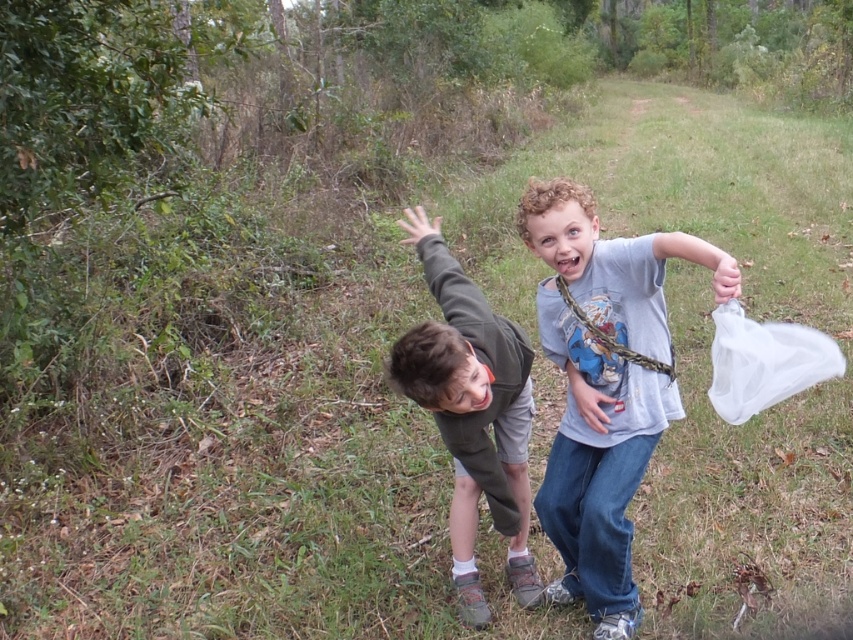
You are a photographer trying to capture both the dark gray fabric shirt at center and the transparent plastic bag at right in a single frame. Which object should you focus on first to ensure both are in the frame without moving the camera?

You should focus on the dark gray fabric shirt at center first because it is wider than the transparent plastic bag at right, so centering it will ensure the narrower bag is also within the frame.

You are a delivery robot that needs to deliver a package to the transparent plastic bag at right. You are currently positioned near the gray cotton shirt at center. Can you safely navigate the 15.57 inches between them without needing to move any objects?

The gray cotton shirt at center and transparent plastic bag at right are 15.57 inches apart, so yes, the robot can safely navigate the 15.57 inches between them without needing to move any objects.

You are a photographer trying to capture both the gray cotton shirt at center and the dark gray fabric shirt at center in a single shot. Which shirt should you focus on first to ensure both are in focus?

You should focus on the gray cotton shirt at center first because it is closer to the viewer than the dark gray fabric shirt at center, ensuring both will be in focus when using a depth of field that accommodates their distance apart.